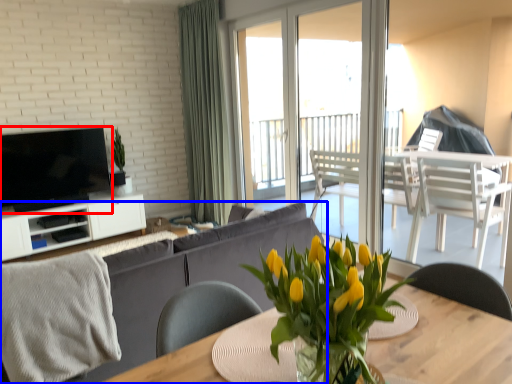
Question: Which point is closer to the camera, television (highlighted by a red box) or studio couch (highlighted by a blue box)?

Choices:
 (A) television
 (B) studio couch

Answer: (B)